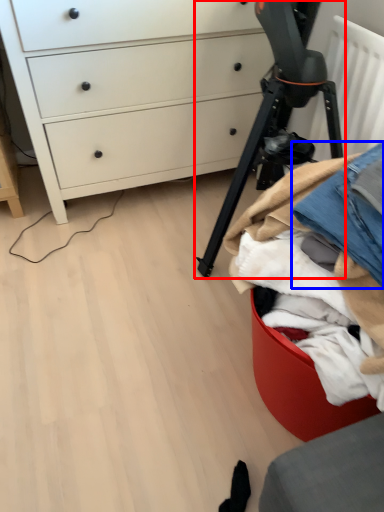
Question: Which of the following is the farthest to the observer, tripod (highlighted by a red box) or jeans (highlighted by a blue box)?

Choices:
 (A) tripod
 (B) jeans

Answer: (A)